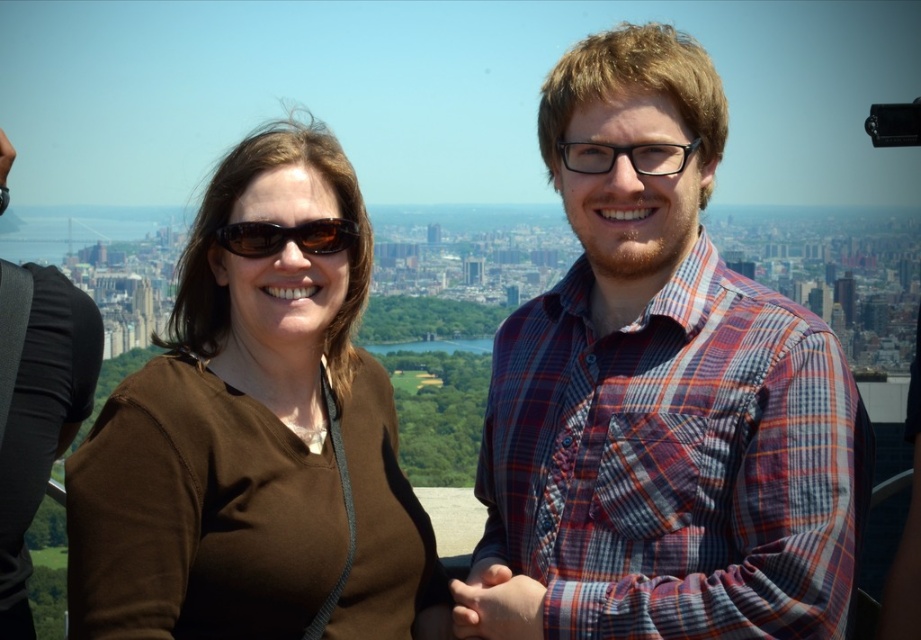
Is point (754, 440) behind point (274, 236)?

No, (754, 440) is in front of (274, 236).

Between point (685, 326) and point (278, 240), which one is positioned behind?

The point (685, 326) is behind.

The image size is (921, 640). Describe the element at coordinates (659, 396) in the screenshot. I see `plaid shirt at center` at that location.

This screenshot has width=921, height=640. Identify the location of plaid shirt at center. (659, 396).

Can you confirm if brown matte shirt at center is wider than matte brown sunglasses at center?

Yes.

Can you confirm if brown matte shirt at center is bigger than matte brown sunglasses at center?

Yes.

Is point (85, 595) closer to viewer compared to point (257, 237)?

Yes, it is.

Locate an element on the screen. This screenshot has height=640, width=921. brown matte shirt at center is located at coordinates (253, 440).

Is plaid shirt at center to the right of brown matte shirt at center from the viewer's perspective?

Correct, you'll find plaid shirt at center to the right of brown matte shirt at center.

Can you confirm if plaid shirt at center is shorter than brown matte shirt at center?

No, plaid shirt at center is not shorter than brown matte shirt at center.

Which is behind, point (627, 477) or point (379, 465)?

Point (379, 465)

Where is `plaid shirt at center`? plaid shirt at center is located at coordinates (659, 396).